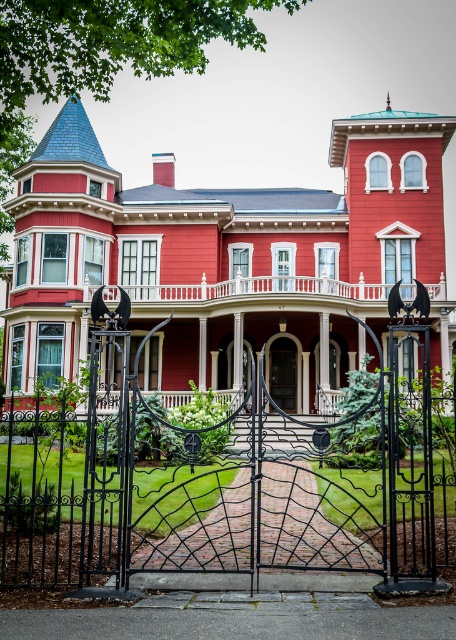
You are standing in front of the Victorian house and want to enter through the smooth wood door at center. To reach the door, you must first step onto the smooth red porch at center. Is the porch above or below the door?

The smooth red porch at center is positioned over the smooth wood door at center, so the porch is above the door.

You are a visitor arriving at the Victorian house and want to enter through the front door. Which object should you approach first, the black wrought iron gate at center or the smooth wood door at center?

You should approach the black wrought iron gate at center first because it is to the left of the smooth wood door at center, meaning it is closer to the entrance path.

You are a delivery person trying to bring a large package through the entrance of the house. The package is 1.2 meters wide. The black wrought iron gate at center and the smooth wood door at center are both potential entry points. Which entry point can the package fit through based on their widths?

The black wrought iron gate at center has a larger width than the smooth wood door at center. Since the package is 1.2 meters wide, it can fit through the black wrought iron gate at center but not the smooth wood door at center.